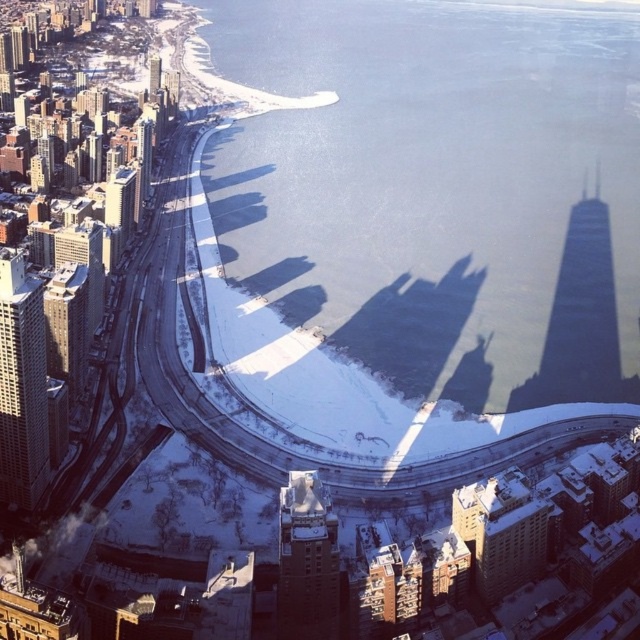
Question: Is clear blue water at center positioned in front of dark gray stone building at center?

Choices:
 (A) no
 (B) yes

Answer: (A)

Question: Does clear blue water at center appear over dark gray stone building at center?

Choices:
 (A) no
 (B) yes

Answer: (B)

Question: Which object is the farthest from the dark gray stone building at center?

Choices:
 (A) gray concrete skyscraper at left
 (B) clear blue water at center

Answer: (B)

Question: Estimate the real-world distances between objects in this image. Which object is farther from the clear blue water at center?

Choices:
 (A) gray concrete skyscraper at left
 (B) dark gray stone building at center

Answer: (A)

Question: Which point appears farthest from the camera in this image?

Choices:
 (A) (29, 365)
 (B) (326, 600)
 (C) (449, 172)

Answer: (C)

Question: Does clear blue water at center appear on the left side of gray concrete skyscraper at left?

Choices:
 (A) yes
 (B) no

Answer: (B)